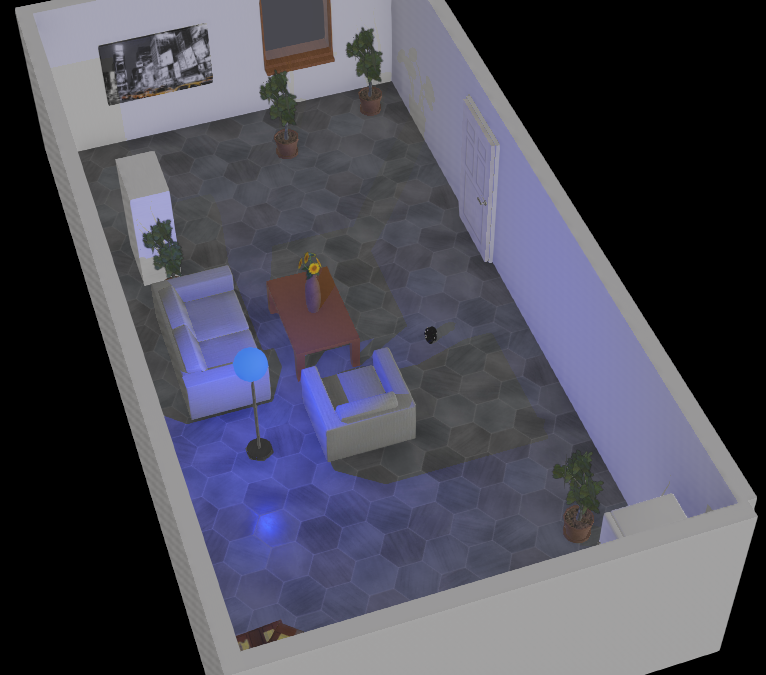
Locate an element on the screen. The height and width of the screenshot is (675, 766). chair is located at coordinates (355, 387).